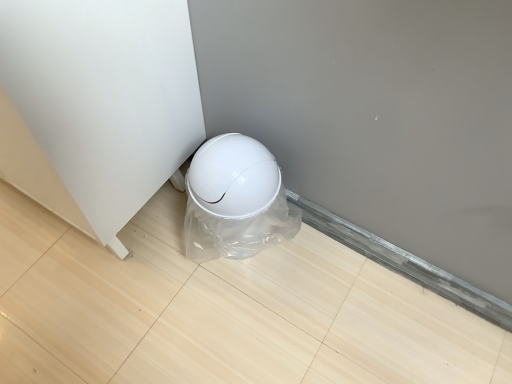
Identify the location of spots to the right of white glossy waste container at lower left. (307, 261).